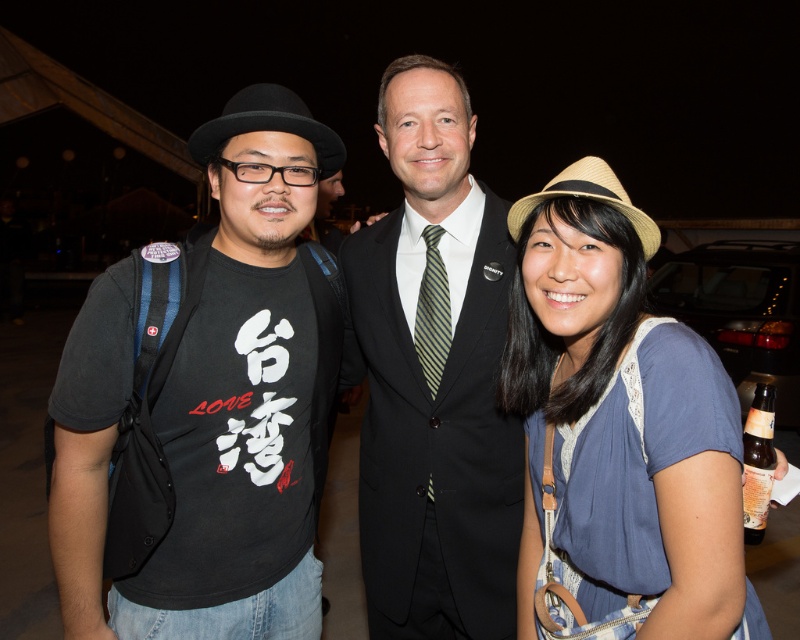
Question: Can you confirm if black matte t-shirt at left is positioned above black suit at center?

Choices:
 (A) yes
 (B) no

Answer: (B)

Question: Is black suit at center to the left of black felt fedora at left from the viewer's perspective?

Choices:
 (A) no
 (B) yes

Answer: (A)

Question: Which object is positioned farthest from the natural straw hat at center?

Choices:
 (A) striped silk tie at center
 (B) blue cotton shirt at center
 (C) black suit at center

Answer: (C)

Question: Among these objects, which one is nearest to the camera?

Choices:
 (A) natural straw hat at center
 (B) blue cotton shirt at center

Answer: (B)

Question: Which object appears closest to the camera in this image?

Choices:
 (A) brown glass bottle at lower right
 (B) black felt fedora at left
 (C) black suit at center
 (D) black matte t-shirt at left

Answer: (D)

Question: In this image, where is blue cotton shirt at center located relative to black suit at center?

Choices:
 (A) right
 (B) left

Answer: (A)